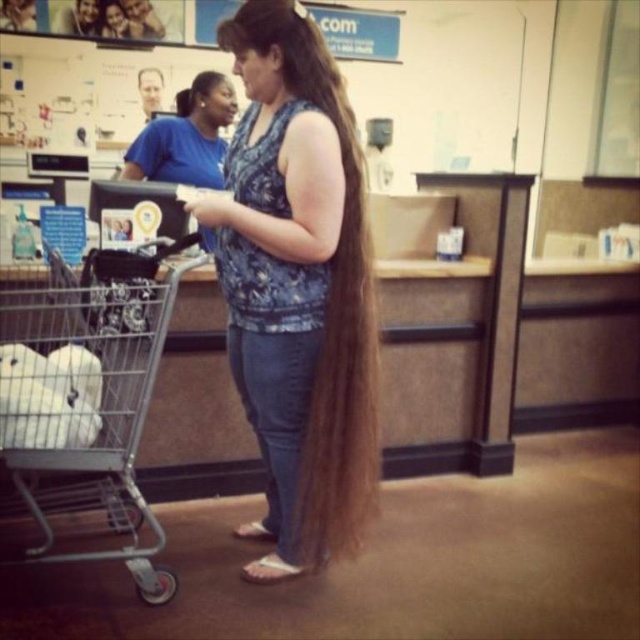
Question: Considering the real-world distances, which object is closest to the blue fabric shirt at center?

Choices:
 (A) blue printed tank top at center
 (B) silver wire shopping cart at left

Answer: (B)

Question: Which of the following is the farthest from the observer?

Choices:
 (A) brown silky hair at center
 (B) blue printed tank top at center
 (C) silver wire shopping cart at left
 (D) blue fabric shirt at center

Answer: (A)

Question: Does blue printed tank top at center have a smaller size compared to silver wire shopping cart at left?

Choices:
 (A) yes
 (B) no

Answer: (A)

Question: Does silver wire shopping cart at left have a lesser width compared to brown silky hair at center?

Choices:
 (A) yes
 (B) no

Answer: (B)

Question: Which point is closer to the camera?

Choices:
 (A) (99, 321)
 (B) (182, 93)
 (C) (228, 336)
 (D) (154, 157)

Answer: (A)

Question: Is blue printed tank top at center to the left of blue fabric shirt at center from the viewer's perspective?

Choices:
 (A) yes
 (B) no

Answer: (B)